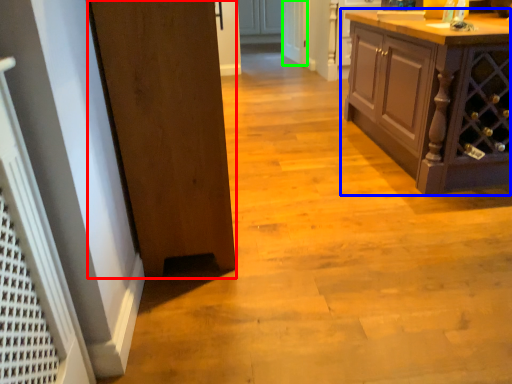
Question: Which is farther away from door (highlighted by a red box)? cabinetry (highlighted by a blue box) or screen door (highlighted by a green box)?

Choices:
 (A) cabinetry
 (B) screen door

Answer: (B)